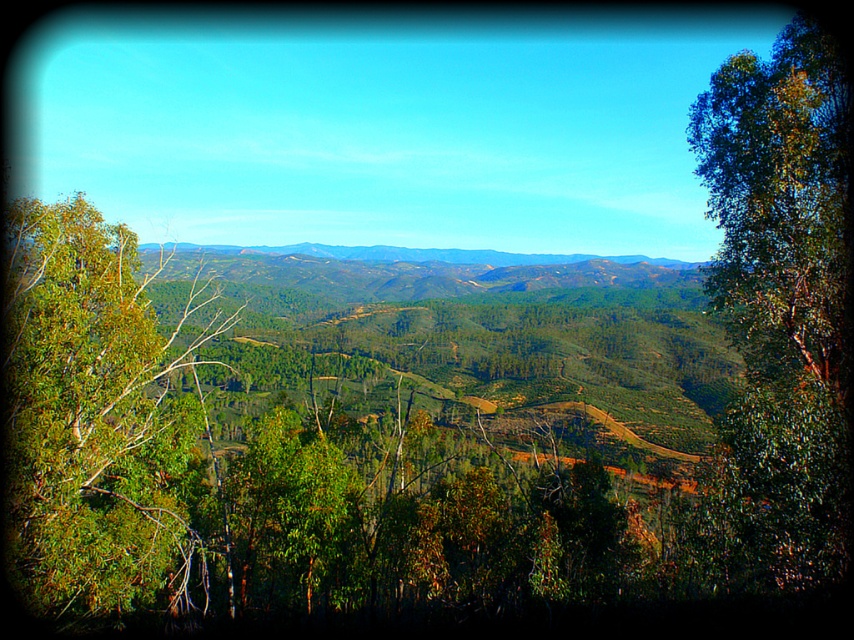
Which is below, green leafy tree at right or green leafy tree at left?

green leafy tree at right is below.

At what (x,y) coordinates should I click in order to perform the action: click on green leafy tree at right. Please return your answer as a coordinate pair (x, y). The height and width of the screenshot is (640, 854). Looking at the image, I should click on (782, 308).